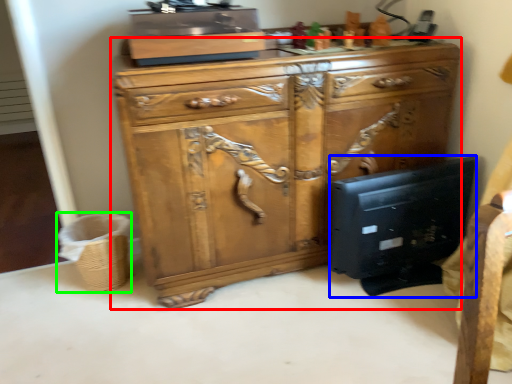
Question: Which object is positioned farthest from chest of drawers (highlighted by a red box)? Select from desktop computer (highlighted by a blue box) and basket (highlighted by a green box).

Choices:
 (A) desktop computer
 (B) basket

Answer: (B)